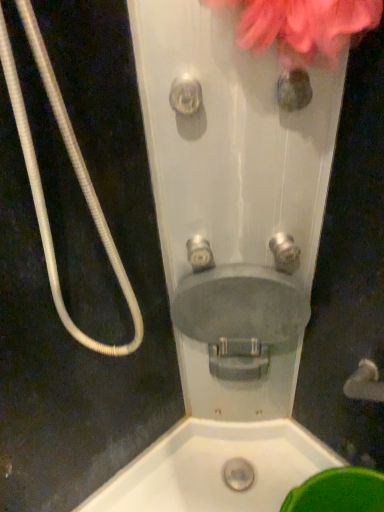
Question: Is clear plastic showerhead at center to the left or to the right of white corrugated hose at left in the image?

Choices:
 (A) left
 (B) right

Answer: (B)

Question: Is clear plastic showerhead at center in front of or behind white corrugated hose at left in the image?

Choices:
 (A) front
 (B) behind

Answer: (B)

Question: Estimate the real-world distances between objects in this image. Which object is closer to the brushed metal faucet at center, the 2th plumbing fixture from the left?

Choices:
 (A) satin silver faucet at center, which is the first plumbing fixture in left-to-right order
 (B) white corrugated hose at left
 (C) matte gray sink at center
 (D) clear plastic showerhead at center
 (E) pink fluffy flower at upper right

Answer: (C)

Question: Based on their relative distances, which object is farther from the white corrugated hose at left?

Choices:
 (A) satin silver faucet at center, which is the first plumbing fixture in left-to-right order
 (B) brushed metal faucet at center, the 2th plumbing fixture from the left
 (C) pink fluffy flower at upper right
 (D) clear plastic showerhead at center
 (E) matte gray sink at center

Answer: (B)